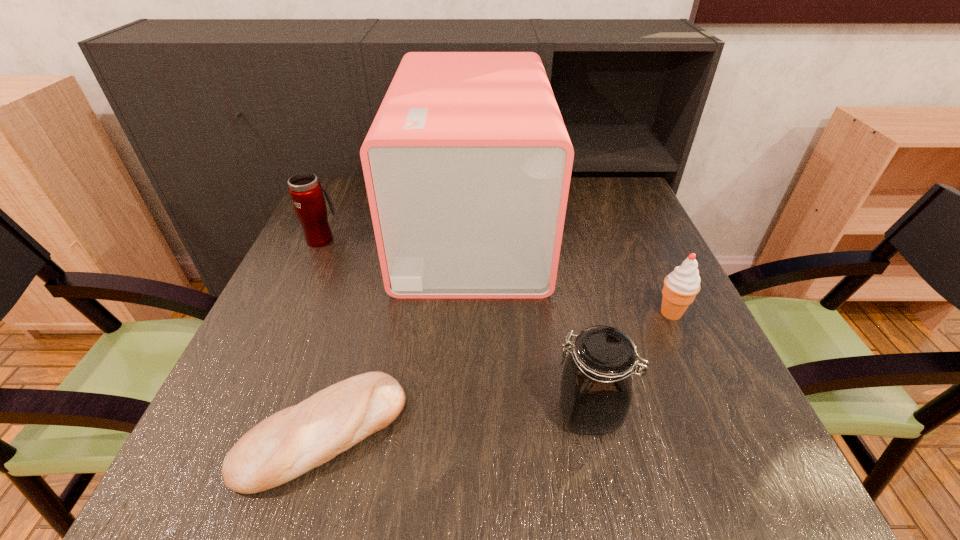
Where is `empty space that is in between the rightmost object and the bread`? empty space that is in between the rightmost object and the bread is located at coordinates (497, 373).

Find the location of `unoccupied area between the jar and the thermos bottle`. unoccupied area between the jar and the thermos bottle is located at coordinates click(455, 326).

Image resolution: width=960 pixels, height=540 pixels. Find the location of `object that can be found as the second closest to the tallest object`. object that can be found as the second closest to the tallest object is located at coordinates (681, 286).

I want to click on the second closest object to the thermos bottle, so click(295, 440).

Locate an element on the screen. free location that satisfies the following two spatial constraints: 1. on the surface of the rightmost object where the text is embossed; 2. on the right side of the box is located at coordinates (470, 313).

Identify the location of vacant space that satisfies the following two spatial constraints: 1. on the surface of the box where the text is embossed; 2. on the front side of the shortest object. (468, 432).

Identify the location of free space that satisfies the following two spatial constraints: 1. on the front side of the icecream; 2. on the lid of the jar. Image resolution: width=960 pixels, height=540 pixels. (x=716, y=412).